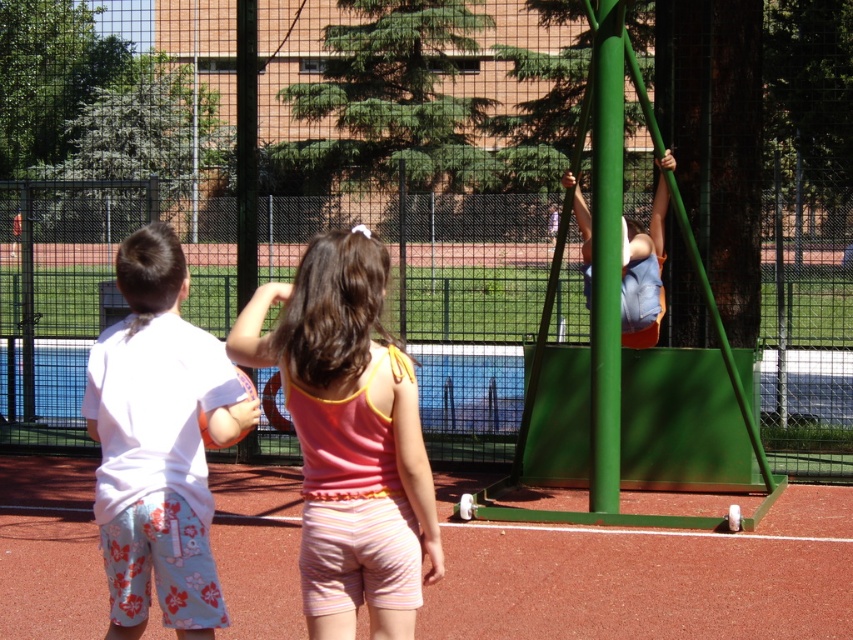
You are a photographer trying to capture the entire scene in one shot. You notice the green matte pole at center and the light blue denim shorts at upper right. Which object takes up more area in the photo?

The light blue denim shorts at upper right take up more area in the photo because the green matte pole at center occupies less space than light blue denim shorts at upper right.

From the picture: You are a photographer standing at the edge of the playground. You want to take a photo that includes both the green matte pole at center and the light blue denim shorts at upper right. Which object will appear larger in the photo?

The green matte pole at center will appear larger in the photo because it is closer to the viewer than the light blue denim shorts at upper right.

You are standing at the point marked as point (93, 362) and want to move towards the point marked as point (648, 280). Will you be moving away from or towards the camera?

→ Moving from point (93, 362) to point (648, 280) would mean moving away from the camera since point (93, 362) is closer to the camera than point (648, 280).